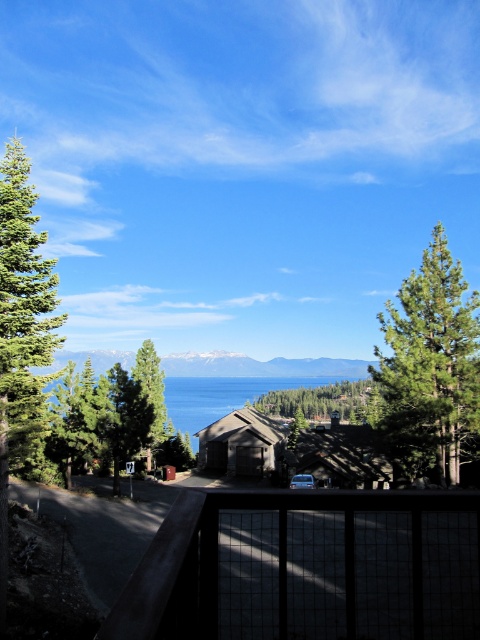
Can you confirm if brown wood cabin at center is taller than green matte tree at center?

In fact, brown wood cabin at center may be shorter than green matte tree at center.

Looking at this image, who is lower down, brown wood cabin at center or green matte tree at center?

brown wood cabin at center

Between point (264, 417) and point (148, 435), which one is positioned behind?

The point (264, 417) is more distant.

I want to click on brown wood cabin at center, so click(x=240, y=444).

Image resolution: width=480 pixels, height=640 pixels. What do you see at coordinates (431, 365) in the screenshot? I see `green textured pine tree at right` at bounding box center [431, 365].

Is green textured pine tree at right in front of green matte tree at center?

Yes, green textured pine tree at right is closer to the viewer.

Between point (455, 317) and point (149, 436), which one is positioned behind?

Point (149, 436)

Locate an element on the screen. green textured pine tree at right is located at coordinates click(431, 365).

Looking at this image, can you confirm if green textured pine tree at right is taller than blue water at center?

No, green textured pine tree at right is not taller than blue water at center.

Where is `green textured pine tree at right`? green textured pine tree at right is located at coordinates (431, 365).